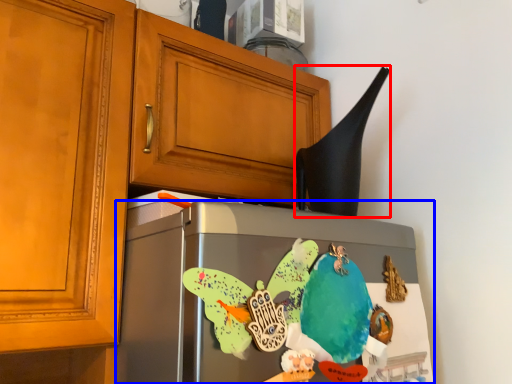
Question: Which object is further to the camera taking this photo, exhaust hood (highlighted by a red box) or refrigerator (highlighted by a blue box)?

Choices:
 (A) exhaust hood
 (B) refrigerator

Answer: (A)